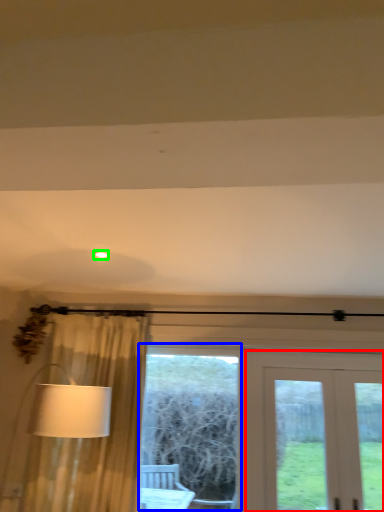
Question: Estimate the real-world distances between objects in this image. Which object is closer to door (highlighted by a red box), bay window (highlighted by a blue box) or lighting (highlighted by a green box)?

Choices:
 (A) bay window
 (B) lighting

Answer: (A)